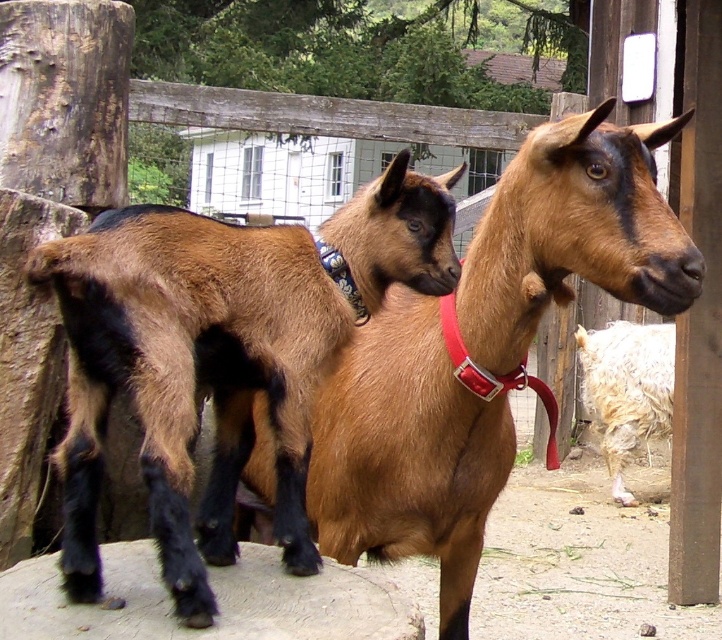
Based on the photo, which is more to the left, brown woolen goat at center or red nylon collar at center?

From the viewer's perspective, brown woolen goat at center appears more on the left side.

Is the position of brown woolen goat at center more distant than that of red nylon collar at center?

No.

Identify the location of brown woolen goat at center. (406, 452).

Find the location of a particular element. brown woolen goat at center is located at coordinates (406, 452).

Is point (453, 337) less distant than point (361, 316)?

No, it is behind (361, 316).

Who is positioned more to the right, red nylon collar at center or blue fabric neckband at upper center?

Positioned to the right is red nylon collar at center.

Where is `red nylon collar at center`? red nylon collar at center is located at coordinates [477, 364].

Between smooth gray rock at center and fluffy white goat at right, which one appears on the left side from the viewer's perspective?

From the viewer's perspective, smooth gray rock at center appears more on the left side.

Can you confirm if smooth gray rock at center is shorter than fluffy white goat at right?

Correct, smooth gray rock at center is not as tall as fluffy white goat at right.

In order to click on smooth gray rock at center in this screenshot , I will do `click(217, 596)`.

Where is `smooth gray rock at center`? smooth gray rock at center is located at coordinates (217, 596).